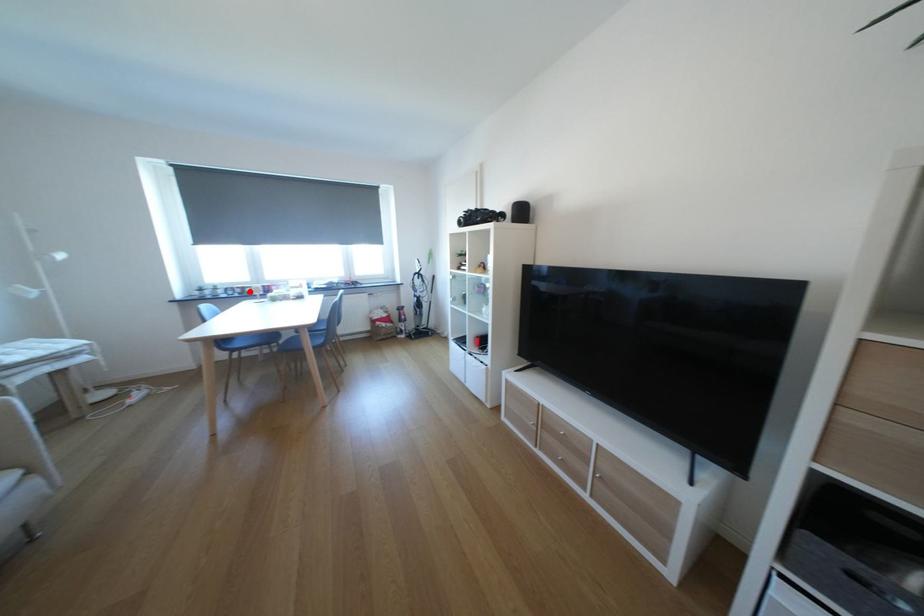
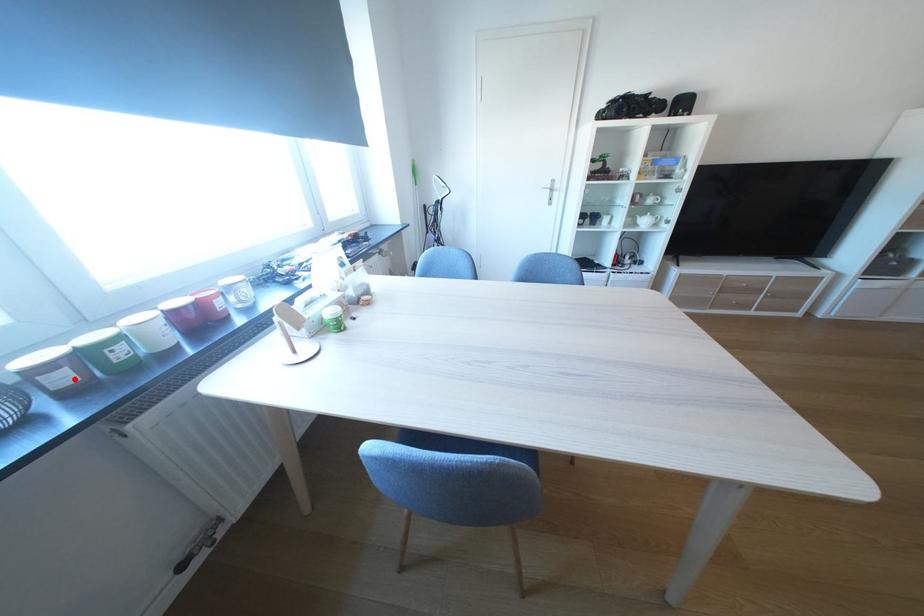
I am providing you with two images of the same scene from different viewpoints. A red point is marked on the first image and another point is marked on the second image. Are the points marked in image1 and image2 representing the same 3D position?

Yes